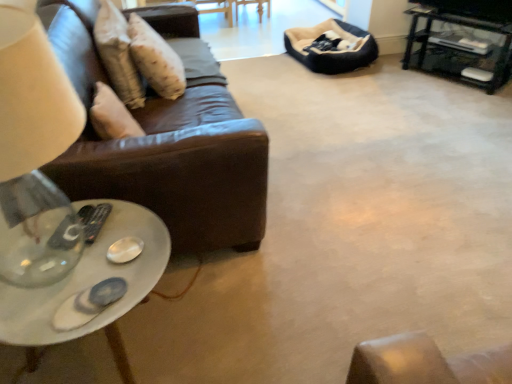
This screenshot has width=512, height=384. In order to click on empty space that is to the right of white glossy coffee table at lower left in this screenshot , I will do `click(249, 318)`.